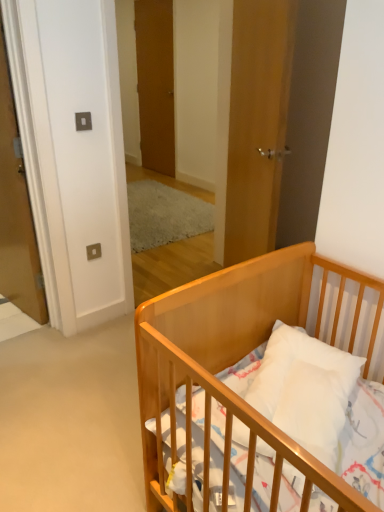
Question: From a real-world perspective, is wooden door at center, positioned as the first door in front-to-back order, located beneath wooden door at center, the second door from the left?

Choices:
 (A) no
 (B) yes

Answer: (B)

Question: Can you confirm if wooden door at center, the third door from the left, is positioned to the left of wooden door at center, the 1th door when ordered from back to front?

Choices:
 (A) yes
 (B) no

Answer: (B)

Question: Is wooden door at center, which is the 2th door from right to left, a part of wooden door at center, acting as the first door starting from the right?

Choices:
 (A) yes
 (B) no

Answer: (B)

Question: Considering the relative sizes of wooden door at center, which is counted as the 3th door, starting from the back, and wooden door at center, the second door from the left, in the image provided, is wooden door at center, which is counted as the 3th door, starting from the back, taller than wooden door at center, the second door from the left,?

Choices:
 (A) yes
 (B) no

Answer: (B)

Question: Can you confirm if wooden door at center, acting as the first door starting from the right, is wider than wooden door at center, which is the 2th door from right to left?

Choices:
 (A) no
 (B) yes

Answer: (B)

Question: In terms of width, does wooden door at center, which is counted as the 3th door, starting from the back, look wider or thinner when compared to matte wood door at left, the first door positioned from the left?

Choices:
 (A) thin
 (B) wide

Answer: (A)

Question: From the image's perspective, is wooden door at center, positioned as the first door in front-to-back order, located above or below matte wood door at left, the 3th door in the right-to-left sequence?

Choices:
 (A) above
 (B) below

Answer: (A)

Question: Is wooden door at center, positioned as the first door in front-to-back order, inside or outside of matte wood door at left, the 3th door in the right-to-left sequence?

Choices:
 (A) outside
 (B) inside

Answer: (A)

Question: In the image, is wooden door at center, acting as the first door starting from the right, positioned in front of or behind matte wood door at left, the first door positioned from the left?

Choices:
 (A) behind
 (B) front

Answer: (B)

Question: Looking at their shapes, would you say wooden door at center, positioned as the first door in front-to-back order, is wider or thinner than light wood crib at lower right?

Choices:
 (A) wide
 (B) thin

Answer: (B)

Question: Considering the positions of point (256, 125) and point (284, 445), is point (256, 125) closer or farther from the camera than point (284, 445)?

Choices:
 (A) farther
 (B) closer

Answer: (A)

Question: In terms of height, does wooden door at center, acting as the first door starting from the right, look taller or shorter compared to light wood crib at lower right?

Choices:
 (A) short
 (B) tall

Answer: (B)

Question: Which is correct: wooden door at center, which is counted as the 3th door, starting from the back, is inside light wood crib at lower right, or outside of it?

Choices:
 (A) outside
 (B) inside

Answer: (A)

Question: Is light wood crib at lower right in front of or behind matte wood door at left, the 3th door in the right-to-left sequence, in the image?

Choices:
 (A) behind
 (B) front

Answer: (B)

Question: Is point (296, 262) positioned closer to the camera than point (18, 146)?

Choices:
 (A) closer
 (B) farther

Answer: (A)